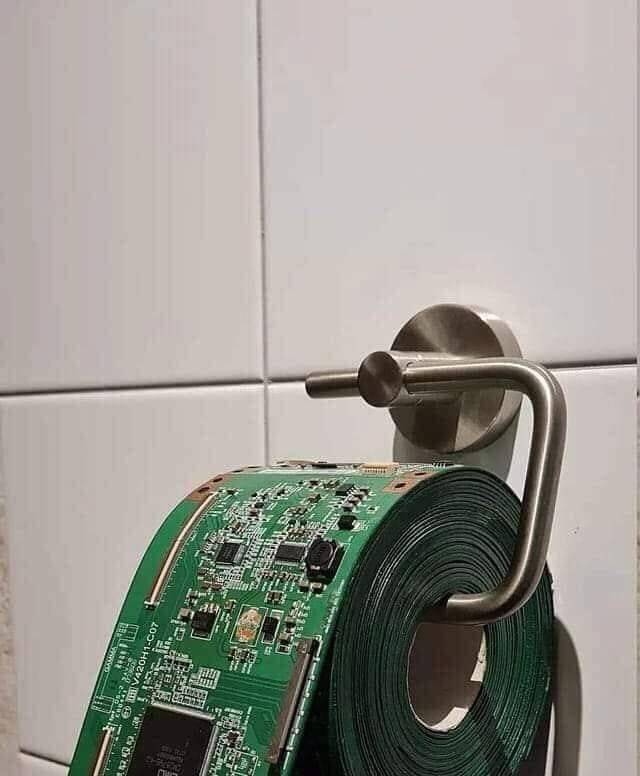
Identify the location of vertical black rectangular piece on the right side of the toilet paper roll. This screenshot has height=776, width=640. (292, 697).